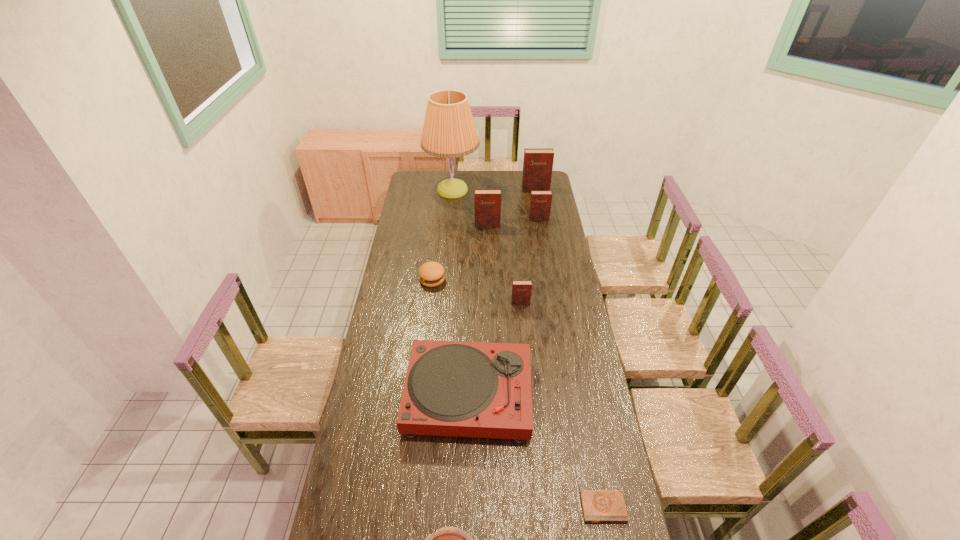
The image size is (960, 540). I want to click on free space at the left edge of the desktop, so click(417, 296).

Locate an element on the screen. Image resolution: width=960 pixels, height=540 pixels. vacant space at the right edge of the desktop is located at coordinates (580, 428).

Identify the location of vacant area that lies between the brown hamburger and the tallest object. (443, 235).

Image resolution: width=960 pixels, height=540 pixels. In order to click on free spot between the second farthest reddish-brown diary and the record player in this screenshot , I will do `click(504, 307)`.

Locate an element on the screen. This screenshot has height=540, width=960. free spot between the farthest diary and the third tallest object is located at coordinates (512, 208).

This screenshot has width=960, height=540. I want to click on empty space between the third tallest object and the tallest object, so click(469, 208).

Find the location of a particular element. This screenshot has height=540, width=960. empty space that is in between the brown hamburger and the biggest reddish-brown diary is located at coordinates point(484,235).

Select which object appears as the eighth closest to the tallest object. Please provide its 2D coordinates. Your answer should be formatted as a tuple, i.e. [(x, y)], where the tuple contains the x and y coordinates of a point satisfying the conditions above.

[(447, 539)]

You are a GUI agent. You are given a task and a screenshot of the screen. Output one action in this format:
    pyautogui.click(x=<x>, y=<y>)
    Task: Click on the object that is the closest to the sixth farthest object
    The height and width of the screenshot is (540, 960).
    Given the screenshot: What is the action you would take?
    pyautogui.click(x=452, y=388)

Identify the location of diary that is the third closest to the brown bowl. The height and width of the screenshot is (540, 960). (487, 202).